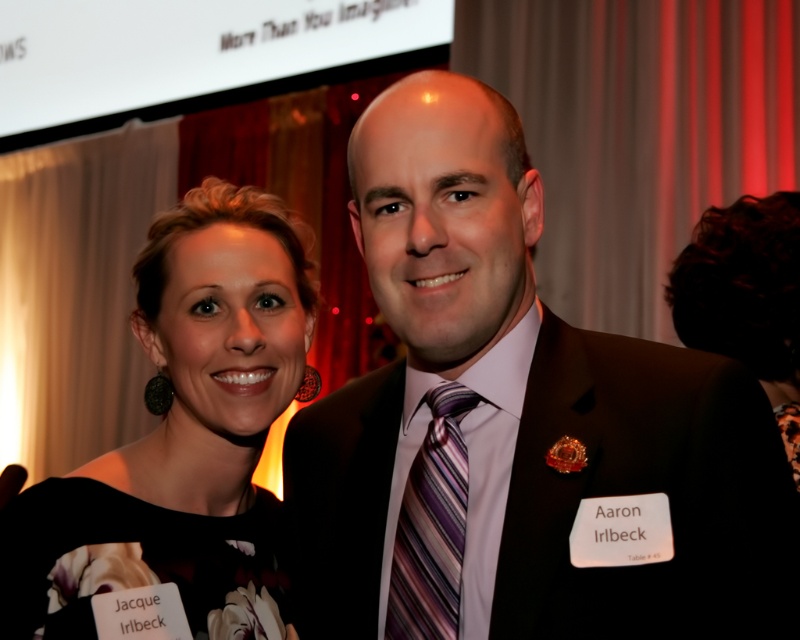
You are a photographer setting up for a group photo. You need to ensure that all participants are visible in the frame. Given the black floral dress at center and the striped silk tie at center, which one is taller and might require adjusting the camera angle to avoid being cropped?

The black floral dress at center is taller than the striped silk tie at center, so you should adjust the camera angle to account for its height to ensure it is fully visible in the frame.

You are a photographer adjusting the lighting for a portrait. You notice the matte black suit at center and the striped silk tie at center in the frame. Based on their positions, which object is closer to the camera?

The matte black suit at center is closer to the camera because it is only 13.25 centimeters away from the striped silk tie at center, indicating it is nearer in the scene.